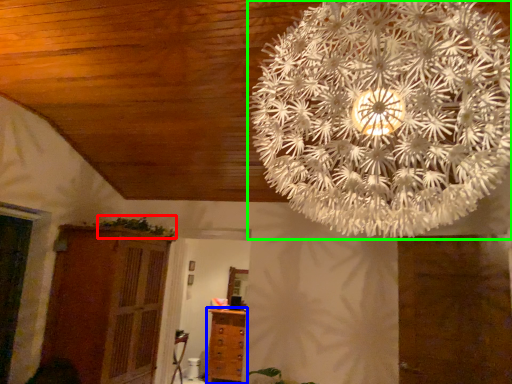
Question: Considering the real-world distances, which object is farthest from plant (highlighted by a red box)? chest of drawers (highlighted by a blue box) or lamp (highlighted by a green box)?

Choices:
 (A) chest of drawers
 (B) lamp

Answer: (B)